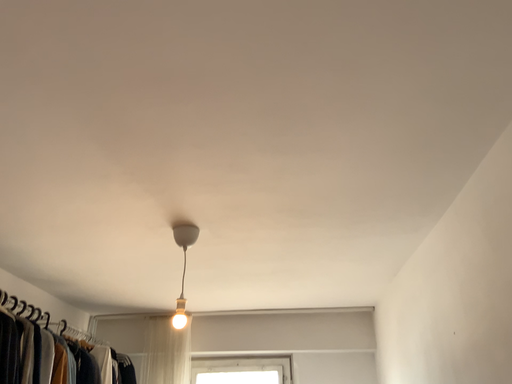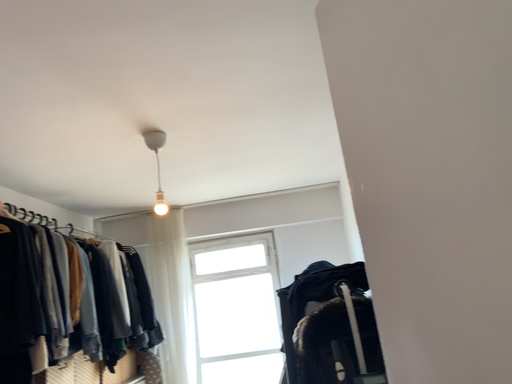
Question: How did the camera likely rotate when shooting the video?

Choices:
 (A) rotated upward
 (B) rotated downward

Answer: (B)